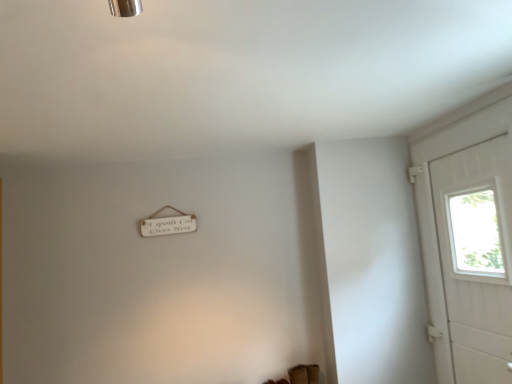
What do you see at coordinates (468, 243) in the screenshot?
I see `white wooden door at right` at bounding box center [468, 243].

Locate an element on the screen. white wooden door at right is located at coordinates click(468, 243).

Where is `white wooden door at right`? The height and width of the screenshot is (384, 512). white wooden door at right is located at coordinates (468, 243).